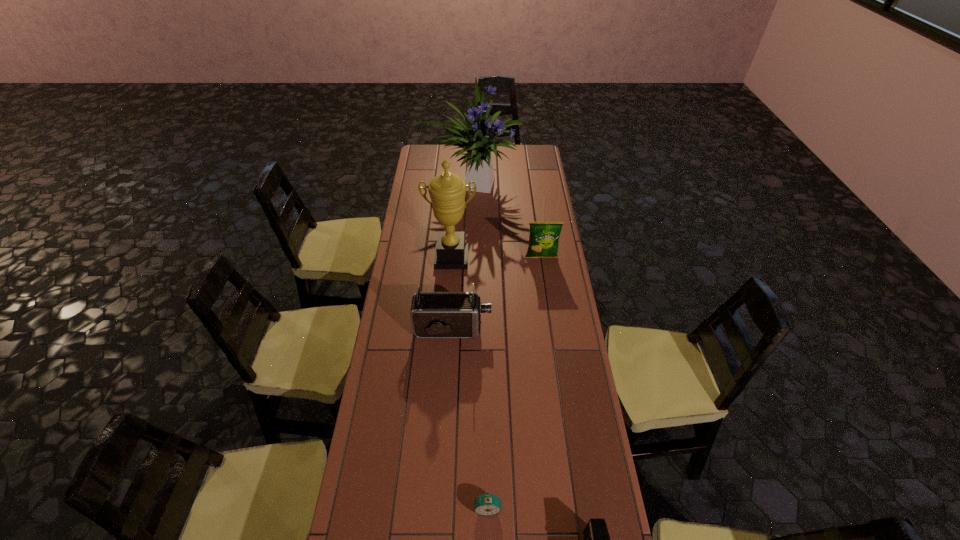
Locate an element on the screen. free space located on the front-facing side of the crisp (potato chip) is located at coordinates (550, 316).

Where is `object that is at the far edge`? Image resolution: width=960 pixels, height=540 pixels. object that is at the far edge is located at coordinates (476, 138).

Locate an element on the screen. flower arrangement positioned at the left edge is located at coordinates (476, 138).

You are a GUI agent. You are given a task and a screenshot of the screen. Output one action in this format:
    pyautogui.click(x=<x>, y=<y>)
    Task: Click on the trophy cup that is at the left edge
    The image size is (960, 540).
    Given the screenshot: What is the action you would take?
    pyautogui.click(x=447, y=191)

Identify the location of camcorder at the left edge. (433, 314).

You are a GUI agent. You are given a task and a screenshot of the screen. Output one action in this format:
    pyautogui.click(x=<x>, y=<y>)
    Task: Click on the flower arrangement situated at the right edge
    The height and width of the screenshot is (540, 960).
    Given the screenshot: What is the action you would take?
    pyautogui.click(x=476, y=138)

Where is `crisp (potato chip) that is at the right edge`? This screenshot has height=540, width=960. crisp (potato chip) that is at the right edge is located at coordinates click(x=543, y=241).

At what (x,y) coordinates should I click in order to perform the action: click on object situated at the far left corner. Please return your answer as a coordinate pair (x, y). Looking at the image, I should click on (476, 138).

Where is `object that is at the far right corner`? object that is at the far right corner is located at coordinates (476, 138).

Locate an element on the screen. free space at the far edge of the desktop is located at coordinates (454, 150).